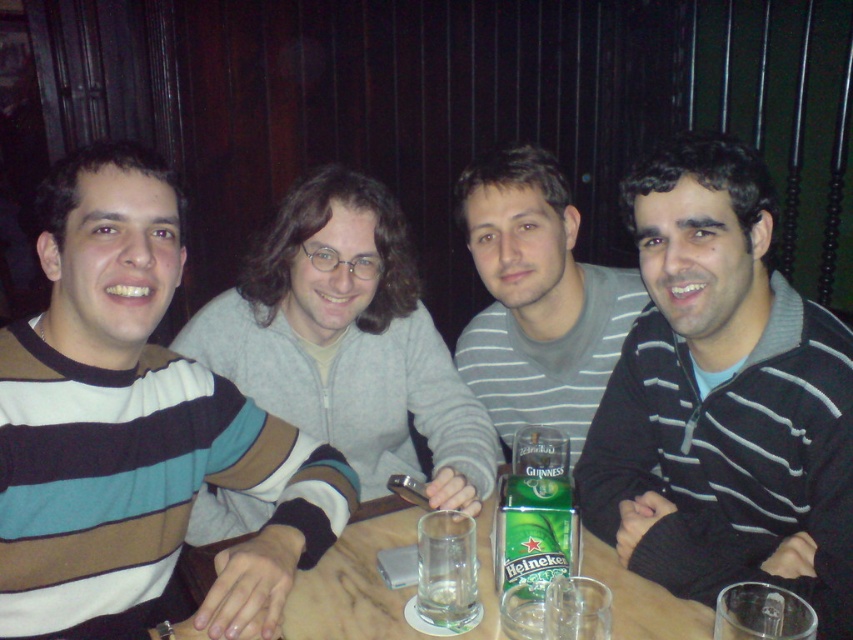
From the picture: You are trying to place a large decorative plate on the table. Considering the size of the black striped sweater at center and the wooden table at center, can you estimate if the plate will fit on the table?

The black striped sweater at center has a lesser width compared to the wooden table at center, so the plate should fit on the wooden table at center since it is wider than the sweater.

Based on the coordinates provided, which object is located at point (723, 397) in the image?

The point (723, 397) marks the location of the black striped sweater at center.

You are standing in front of the table and want to reach the two points marked on the table. Which point, point (125, 396) or point (561, 419), is closer to you?

Point (125, 396) is closer to the viewer than point (561, 419).